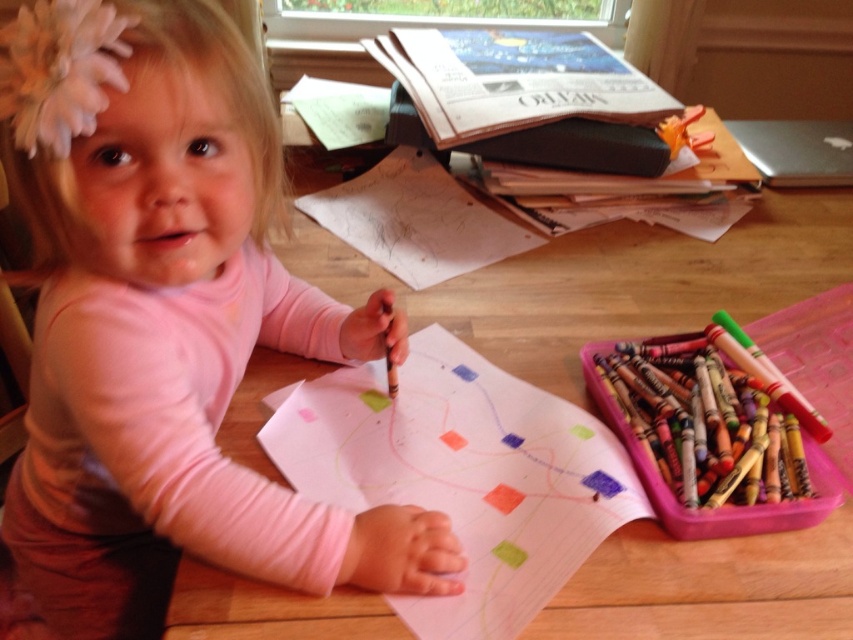
Question: Estimate the real-world distances between objects in this image. Which object is farther from the wooden table at center?

Choices:
 (A) smooth white paper at center
 (B) smooth pink crayon at lower right

Answer: (B)

Question: Can you confirm if matte pink shirt at center is positioned to the left of smooth white paper at center?

Choices:
 (A) yes
 (B) no

Answer: (A)

Question: Which of the following is the farthest from the observer?

Choices:
 (A) smooth white paper at center
 (B) matte pink shirt at center
 (C) multicolored wax crayon at lower right

Answer: (C)

Question: Which point is farther to the camera?

Choices:
 (A) (819, 600)
 (B) (804, 468)
 (C) (25, 576)

Answer: (C)

Question: Can you confirm if matte pink shirt at center is thinner than smooth pink crayon at lower right?

Choices:
 (A) yes
 (B) no

Answer: (B)

Question: Can you confirm if wooden table at center is positioned to the left of smooth pink crayon at lower right?

Choices:
 (A) yes
 (B) no

Answer: (A)